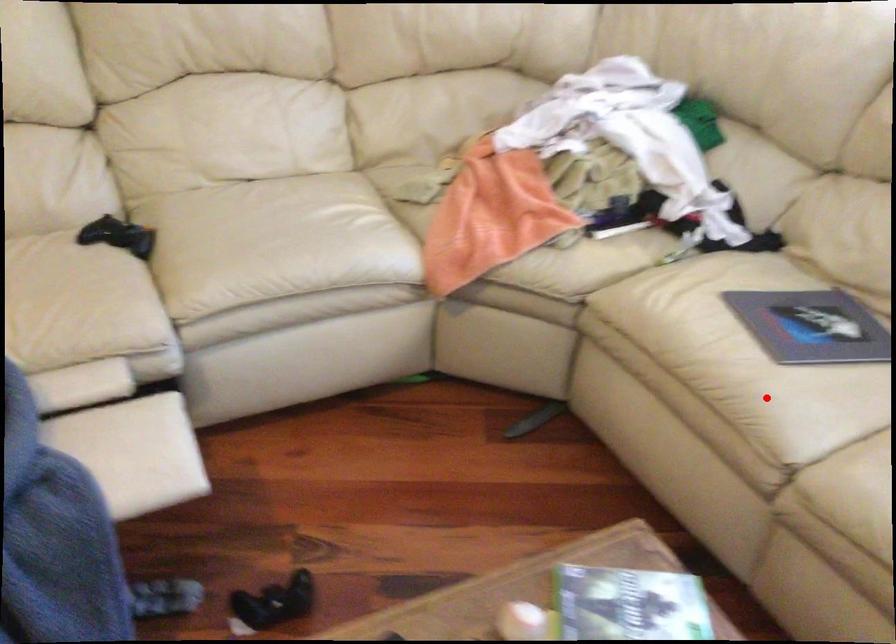
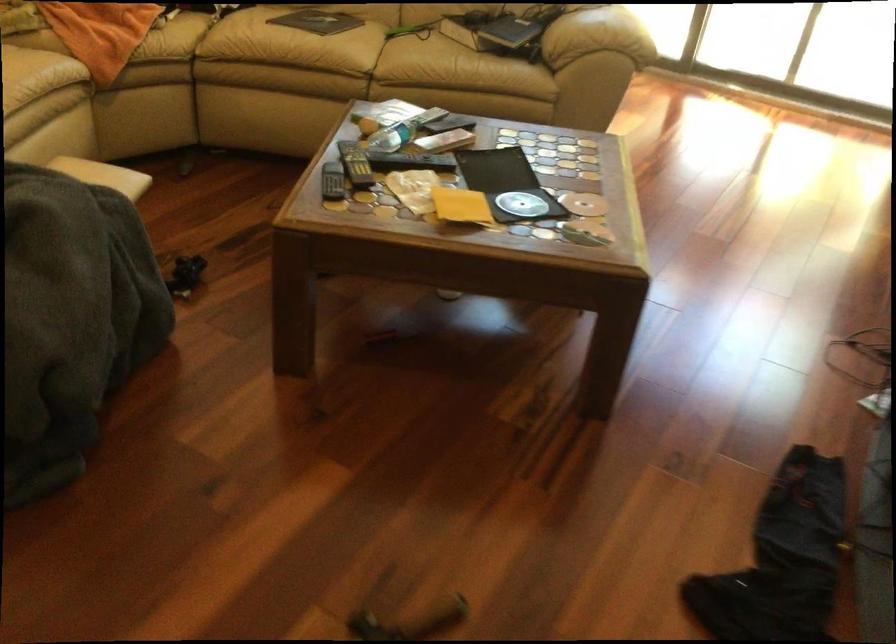
Question: I am providing you with two images of the same scene from different viewpoints. In image1, a red point is highlighted. Considering the same 3D point in image2, which of the following is correct?

Choices:
 (A) It is closer
 (B) It is farther

Answer: (B)